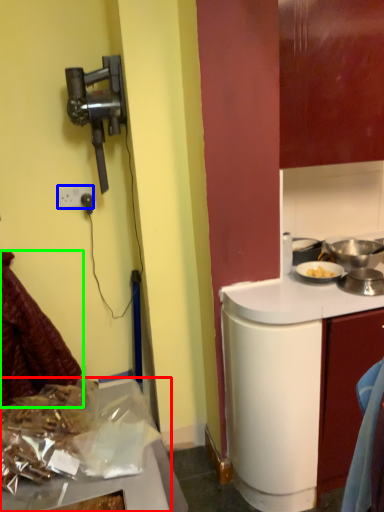
Question: Which object is the closest to the kitchen appliance (highlighted by a red box)? Choose among these: power outlet (highlighted by a blue box) or laundry (highlighted by a green box).

Choices:
 (A) power outlet
 (B) laundry

Answer: (B)